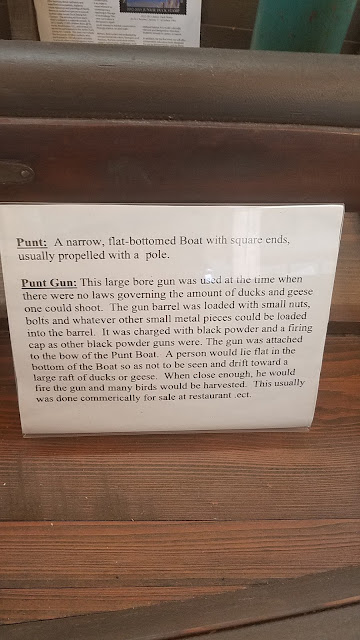
In order to click on paper with unreadable text in this screenshot , I will do `click(93, 18)`.